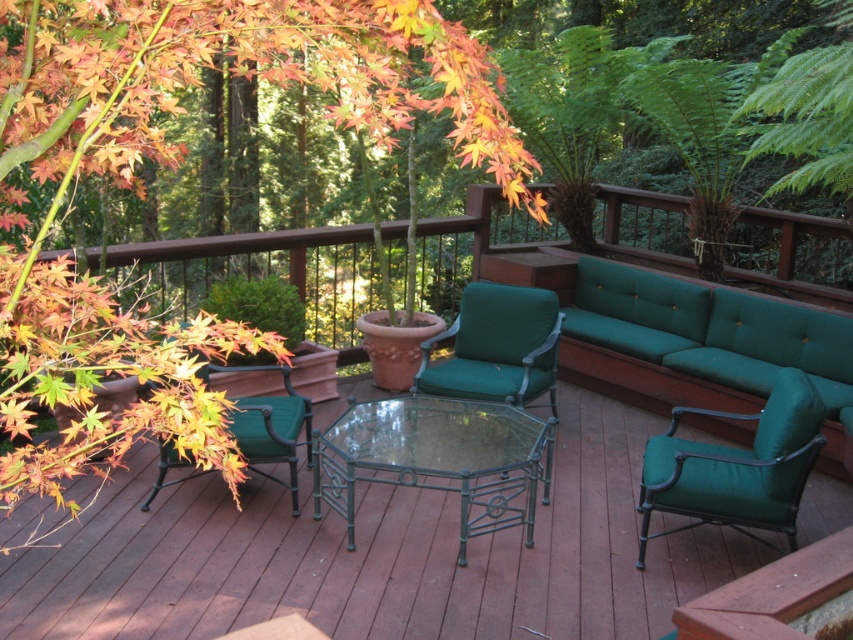
Question: Does matte orange maple leaves at upper left have a lesser width compared to green fabric armchair at left?

Choices:
 (A) yes
 (B) no

Answer: (B)

Question: Is clear glass table at center bigger than green fabric armchair at center?

Choices:
 (A) no
 (B) yes

Answer: (B)

Question: Which point is farther to the camera?

Choices:
 (A) green fabric armchair at right
 (B) green fabric armchair at left
 (C) matte orange maple leaves at upper left
 (D) clear glass table at center

Answer: (B)

Question: Which point is farther to the camera?

Choices:
 (A) 396,502
 (B) 291,394

Answer: (B)

Question: Is green fabric couch at right bigger than green fabric armchair at right?

Choices:
 (A) no
 (B) yes

Answer: (B)

Question: Which of the following is the closest to the observer?

Choices:
 (A) (341, 97)
 (B) (547, 483)
 (C) (666, 433)

Answer: (B)